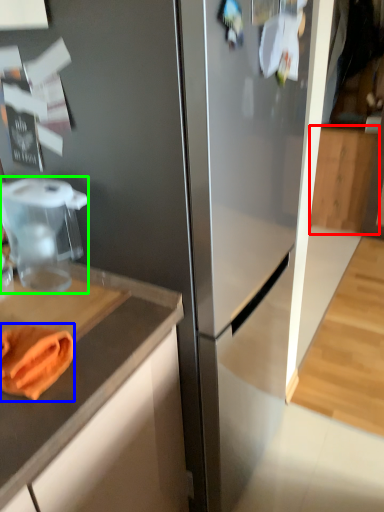
Question: Which is farther away from cabinetry (highlighted by a red box)? food (highlighted by a blue box) or food processor (highlighted by a green box)?

Choices:
 (A) food
 (B) food processor

Answer: (A)